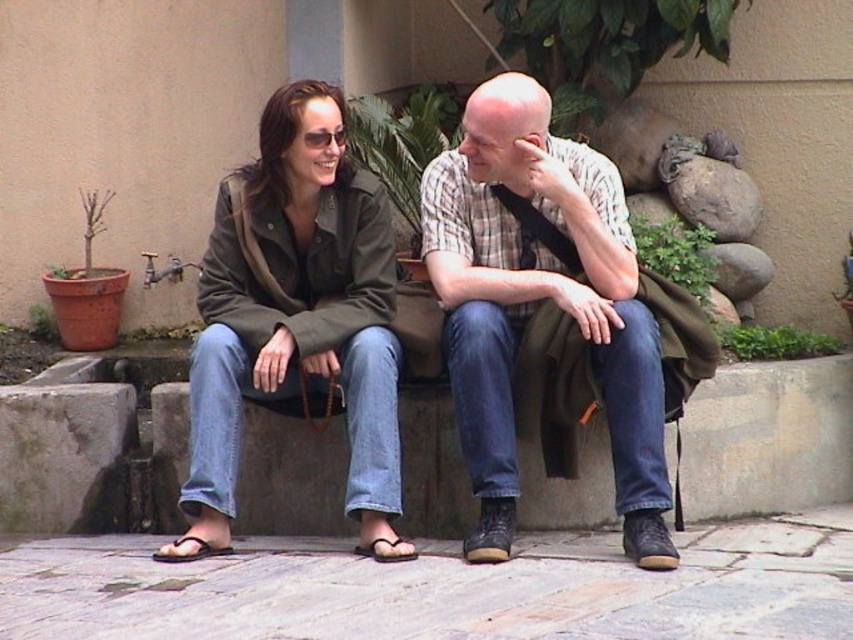
Question: Which point is farther from the camera taking this photo?

Choices:
 (A) (207, 282)
 (B) (387, 554)
 (C) (183, 557)
 (D) (300, 227)

Answer: (D)

Question: Which is nearer to the brown leather sandal at lower center?

Choices:
 (A) matte olive-green jacket at center
 (B) purple fabric sandal at lower left

Answer: (B)

Question: Considering the relative positions of matte plaid shirt at center and purple fabric sandal at lower left in the image provided, where is matte plaid shirt at center located with respect to purple fabric sandal at lower left?

Choices:
 (A) above
 (B) below

Answer: (A)

Question: Is the position of matte plaid shirt at center less distant than that of brown leather sandal at lower center?

Choices:
 (A) no
 (B) yes

Answer: (B)

Question: Considering the real-world distances, which object is farthest from the matte plaid shirt at center?

Choices:
 (A) purple fabric sandal at lower left
 (B) matte olive-green jacket at center

Answer: (A)

Question: Is matte plaid shirt at center to the right of brown leather sandal at lower center from the viewer's perspective?

Choices:
 (A) yes
 (B) no

Answer: (A)